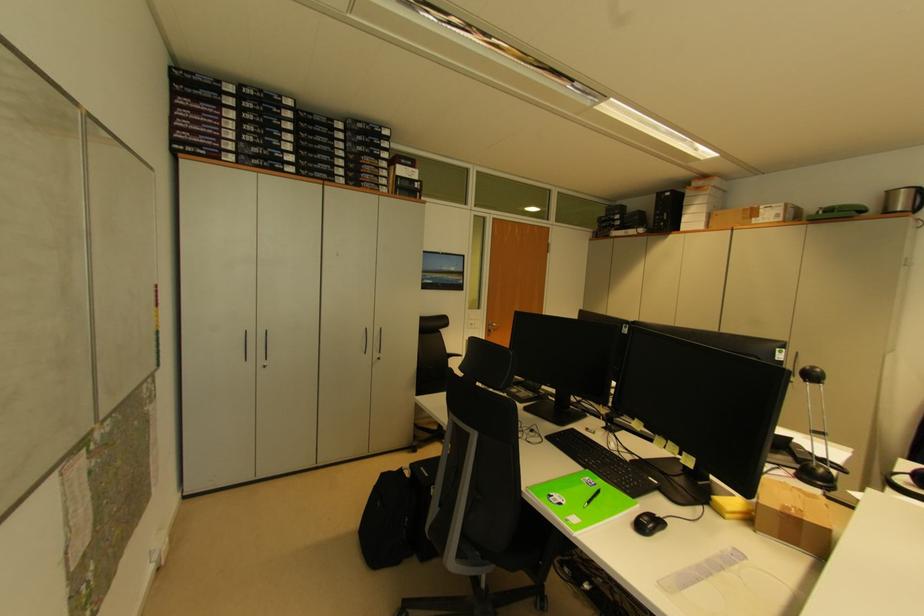
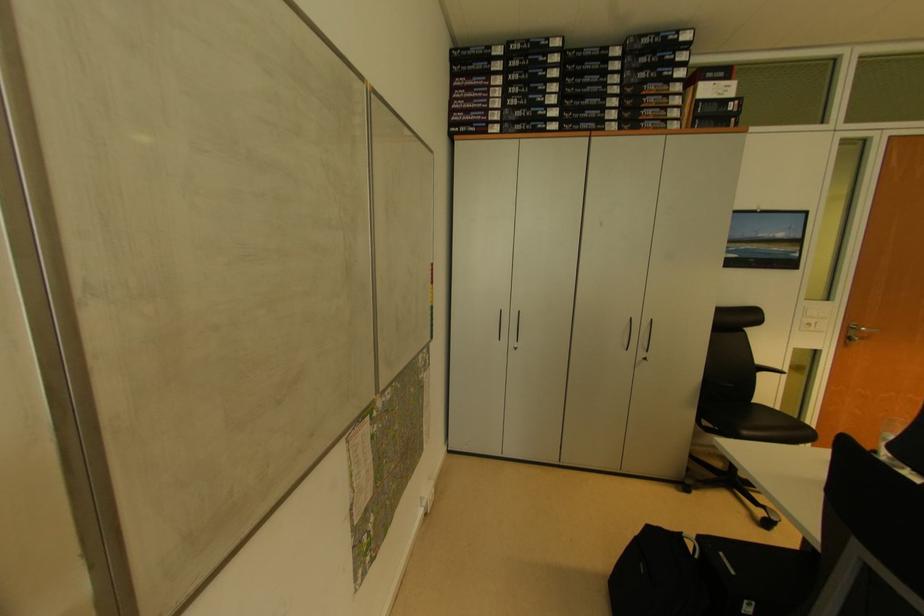
Where in the second image is the point corresponding to (x=381, y=353) from the first image?

(649, 351)